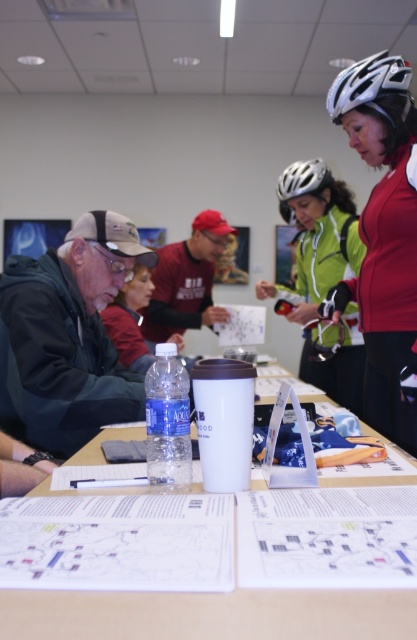
Can you confirm if white paper at center is positioned to the left of matte black helmet at upper right?

Correct, you'll find white paper at center to the left of matte black helmet at upper right.

Is white paper at center bigger than matte black helmet at upper right?

Actually, white paper at center might be smaller than matte black helmet at upper right.

Image resolution: width=417 pixels, height=640 pixels. I want to click on white paper at center, so click(x=210, y=614).

Can you confirm if green matte jacket at center is positioned above matte black jacket at left?

Yes.

Between green matte jacket at center and matte black jacket at left, which one has more height?

With more height is green matte jacket at center.

Who is more distant from viewer, (301, 317) or (133, 282)?

Positioned behind is point (133, 282).

Locate an element on the screen. green matte jacket at center is located at coordinates (316, 236).

Is white paper at center to the left of silver metallic helmet at upper center from the viewer's perspective?

Correct, you'll find white paper at center to the left of silver metallic helmet at upper center.

The width and height of the screenshot is (417, 640). Identify the location of white paper at center. (210, 614).